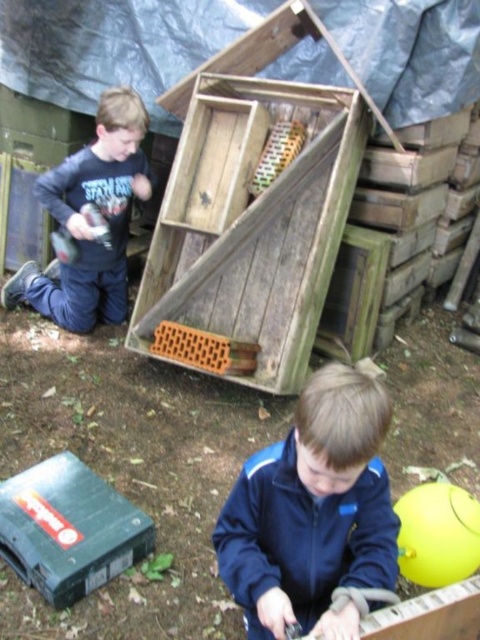
The width and height of the screenshot is (480, 640). What do you see at coordinates (312, 509) in the screenshot?
I see `dark blue jacket at center` at bounding box center [312, 509].

Does dark blue jacket at center appear over dark blue fleece at left?

No, dark blue jacket at center is not above dark blue fleece at left.

Between point (346, 483) and point (56, 212), which one is positioned behind?

The point (56, 212) is behind.

Find the location of a particular element. dark blue jacket at center is located at coordinates (312, 509).